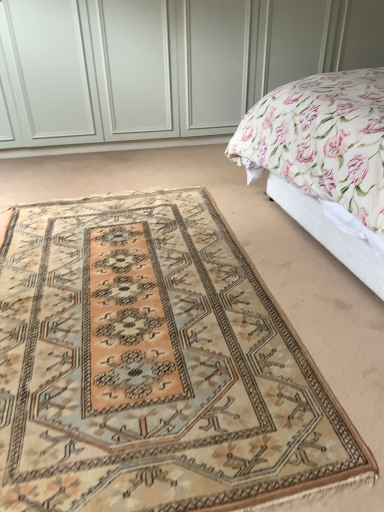
What is the approximate width of floral fabric bed at upper right?

The width of floral fabric bed at upper right is 4.21 feet.

Describe the element at coordinates (325, 162) in the screenshot. I see `floral fabric bed at upper right` at that location.

Image resolution: width=384 pixels, height=512 pixels. What are the coordinates of `floral fabric bed at upper right` in the screenshot? It's located at (325, 162).

Where is `beige wool rug at center`? beige wool rug at center is located at coordinates [x=154, y=366].

The height and width of the screenshot is (512, 384). What do you see at coordinates (154, 366) in the screenshot?
I see `beige wool rug at center` at bounding box center [154, 366].

Find the location of `floral fabric bed at upper right`. floral fabric bed at upper right is located at coordinates (325, 162).

Is beige wool rug at center at the left side of floral fabric bed at upper right?

Correct, you'll find beige wool rug at center to the left of floral fabric bed at upper right.

In the image, is beige wool rug at center positioned in front of or behind floral fabric bed at upper right?

Result: Visually, beige wool rug at center is located in front of floral fabric bed at upper right.

Considering the points (70, 381) and (286, 106), which point is in front, point (70, 381) or point (286, 106)?

The point (70, 381) is closer.

From the image's perspective, is beige wool rug at center located above or below floral fabric bed at upper right?

Clearly, from the image's perspective, beige wool rug at center is below floral fabric bed at upper right.

From a real-world perspective, who is located higher, beige wool rug at center or floral fabric bed at upper right?

floral fabric bed at upper right, from a real-world perspective.

Looking at this image, between beige wool rug at center and floral fabric bed at upper right, which one has smaller width?

floral fabric bed at upper right.

Considering the sizes of objects beige wool rug at center and floral fabric bed at upper right in the image provided, who is shorter, beige wool rug at center or floral fabric bed at upper right?

beige wool rug at center is shorter.

Which of these two, beige wool rug at center or floral fabric bed at upper right, is bigger?

floral fabric bed at upper right.

Which is correct: beige wool rug at center is inside floral fabric bed at upper right, or outside of it?

beige wool rug at center is not inside floral fabric bed at upper right, it's outside.

Is beige wool rug at center not close to floral fabric bed at upper right?

No, beige wool rug at center is not far from floral fabric bed at upper right.

Could you tell me if beige wool rug at center is turned towards floral fabric bed at upper right?

No.

Can you tell me how much beige wool rug at center and floral fabric bed at upper right differ in facing direction?

The angle between the facing direction of beige wool rug at center and the facing direction of floral fabric bed at upper right is 86.9 degrees.

At what (x,y) coordinates should I click in order to perform the action: click on bed above the beige wool rug at center (from the image's perspective). Please return your answer as a coordinate pair (x, y). Looking at the image, I should click on (325, 162).

Considering the positions of objects floral fabric bed at upper right and beige wool rug at center in the image provided, who is more to the left, floral fabric bed at upper right or beige wool rug at center?

Positioned to the left is beige wool rug at center.

Is the depth of floral fabric bed at upper right less than that of beige wool rug at center?

No, floral fabric bed at upper right is further to the viewer.

Is point (286, 132) closer or farther from the camera than point (328, 390)?

Point (286, 132) is farther from the camera than point (328, 390).

From the image's perspective, between floral fabric bed at upper right and beige wool rug at center, who is located below?

beige wool rug at center.

From a real-world perspective, which object stands above the other?

In real-world perspective, floral fabric bed at upper right is above.

Is floral fabric bed at upper right wider or thinner than beige wool rug at center?

In the image, floral fabric bed at upper right appears to be more narrow than beige wool rug at center.

Which of these two, floral fabric bed at upper right or beige wool rug at center, stands shorter?

beige wool rug at center is shorter.

Considering the sizes of objects floral fabric bed at upper right and beige wool rug at center in the image provided, who is bigger, floral fabric bed at upper right or beige wool rug at center?

floral fabric bed at upper right.

Is beige wool rug at center located within floral fabric bed at upper right?

No, beige wool rug at center is not inside floral fabric bed at upper right.

Is floral fabric bed at upper right far away from beige wool rug at center?

Actually, floral fabric bed at upper right and beige wool rug at center are a little close together.

Does floral fabric bed at upper right turn towards beige wool rug at center?

Yes, floral fabric bed at upper right is aimed at beige wool rug at center.

The height and width of the screenshot is (512, 384). Identify the location of mat lying on the left of floral fabric bed at upper right. (154, 366).

Identify the location of bed lying behind the beige wool rug at center. (325, 162).

The height and width of the screenshot is (512, 384). I want to click on mat lying on the left of floral fabric bed at upper right, so click(x=154, y=366).